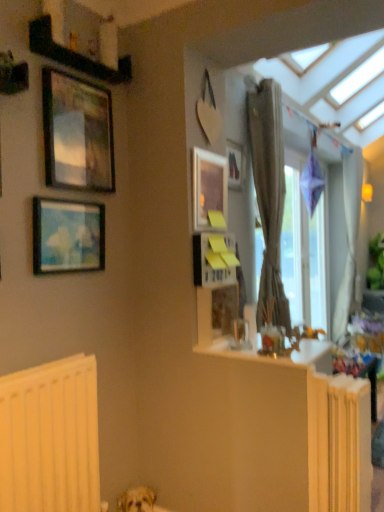
Question: Looking at their shapes, would you say light brown fur at lower center is wider or thinner than wooden picture frame at upper center, acting as the 4th picture frame starting from the front?

Choices:
 (A) wide
 (B) thin

Answer: (A)

Question: Is light brown fur at lower center to the left or to the right of wooden picture frame at upper center, acting as the 4th picture frame starting from the front, in the image?

Choices:
 (A) left
 (B) right

Answer: (A)

Question: Which object is positioned closest to the black wood shelf at upper left?

Choices:
 (A) metallic gold picture frame at upper left, which ranks as the 3th picture frame in right-to-left order
 (B) matte wooden picture frame at upper center, the second picture frame in the back-to-front sequence
 (C) textured beige curtain at right, the second curtain from the back
 (D) white sheer curtain at right, the second curtain viewed from the front
 (E) matte blue painting at upper left, positioned as the first picture frame in front-to-back order

Answer: (A)

Question: Estimate the real-world distances between objects in this image. Which object is closer to the metallic gold picture frame at upper left, which ranks as the 3th picture frame in right-to-left order?

Choices:
 (A) yellow painted radiator at lower right, which is the first radiator from right to left
 (B) white sheer curtain at right, which ranks as the first curtain in right-to-left order
 (C) transparent glass window at right
 (D) textured beige curtain at right, acting as the second curtain starting from the right
 (E) light brown fur at lower center

Answer: (D)